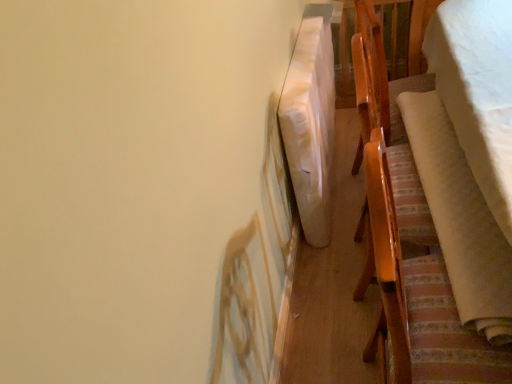
Question: Considering their positions, is white soft blanket at right, the 1th blanket positioned from the right, located in front of or behind wooden chair at right?

Choices:
 (A) front
 (B) behind

Answer: (A)

Question: In terms of size, does white soft blanket at right, acting as the 3th blanket starting from the left, appear bigger or smaller than wooden chair at right?

Choices:
 (A) small
 (B) big

Answer: (B)

Question: Which of these objects is positioned closest to the wooden chair at right?

Choices:
 (A) white fabric blanket at upper right, which is the first blanket in left-to-right order
 (B) white soft blanket at right, which ranks as the 2th blanket in right-to-left order
 (C) white soft blanket at right, the 1th blanket positioned from the right

Answer: (B)

Question: Which of these objects is positioned closest to the wooden chair at right?

Choices:
 (A) white fabric blanket at upper right, which is the first blanket in left-to-right order
 (B) white soft blanket at right, the 1th blanket positioned from the right
 (C) white soft blanket at right, the second blanket when ordered from left to right

Answer: (C)